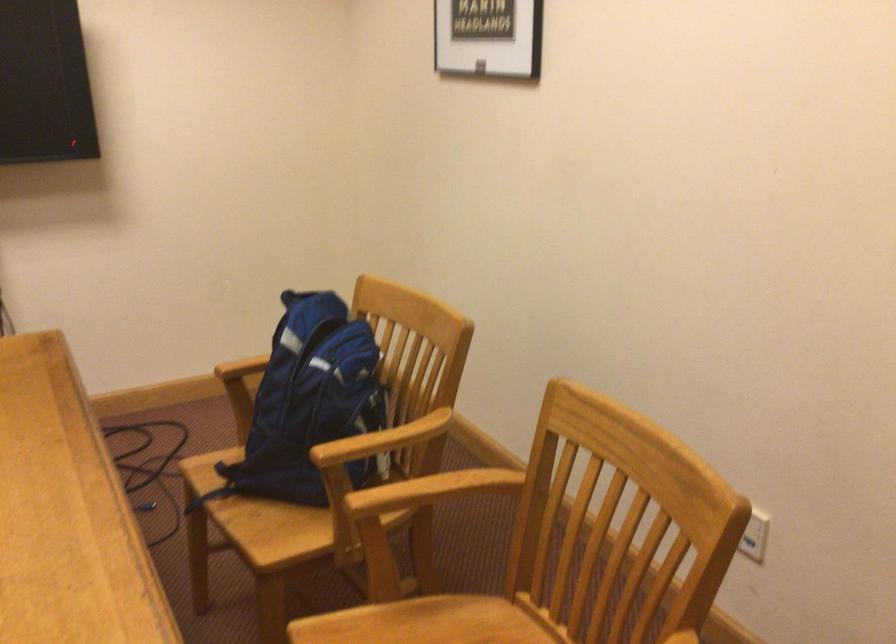
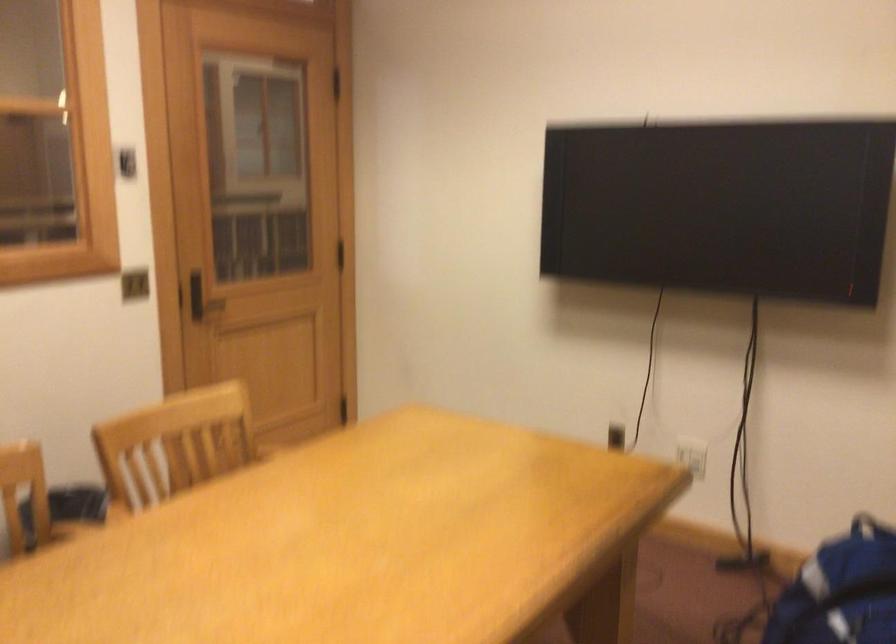
Question: The camera is either moving clockwise (left) or counter-clockwise (right) around the object. The first image is from the beginning of the video and the second image is from the end. Is the camera moving left or right when shooting the video?

Choices:
 (A) Left
 (B) Right

Answer: (B)